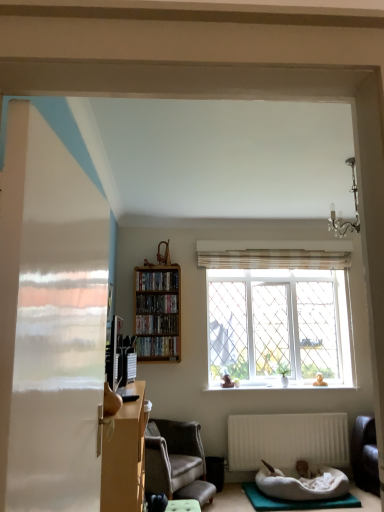
Describe the element at coordinates (156, 324) in the screenshot. I see `black glossy bookshelf at center, marked as the 2th book in a bottom-to-top arrangement` at that location.

What is the approximate height of white glass window at center?

white glass window at center is 4.41 feet in height.

This screenshot has height=512, width=384. What do you see at coordinates (278, 312) in the screenshot?
I see `white glass window at center` at bounding box center [278, 312].

You are a GUI agent. You are given a task and a screenshot of the screen. Output one action in this format:
    pyautogui.click(x=<x>, y=<y>)
    Task: Click on the dark gray fabric chair at lower left
    
    Given the screenshot: What is the action you would take?
    pyautogui.click(x=176, y=461)

The image size is (384, 512). What do you see at coordinates (287, 440) in the screenshot? I see `white matte radiator at lower center` at bounding box center [287, 440].

Describe the element at coordinates (157, 346) in the screenshot. I see `matte black bookshelf at center, which is the first book from bottom to top` at that location.

The height and width of the screenshot is (512, 384). What do you see at coordinates (294, 501) in the screenshot? I see `teal fabric yoga mat at lower right` at bounding box center [294, 501].

Find the location of `black glossy bookshelf at center, the 3th book when ordered from top to bottom`. black glossy bookshelf at center, the 3th book when ordered from top to bottom is located at coordinates (156, 324).

Who is more distant, shiny plastic dvds at center, the third book in the bottom-to-top sequence, or matte black bookshelf at center, which is the first book from bottom to top?

shiny plastic dvds at center, the third book in the bottom-to-top sequence, is more distant.

Is matte black bookshelf at center, which is counted as the fourth book, starting from the top, surrounded by shiny plastic dvds at center, acting as the second book starting from the top?

No, matte black bookshelf at center, which is counted as the fourth book, starting from the top, is not a part of shiny plastic dvds at center, acting as the second book starting from the top.

From the image's perspective, is shiny plastic dvds at center, the third book in the bottom-to-top sequence, above or below matte black bookshelf at center, which is counted as the fourth book, starting from the top?

shiny plastic dvds at center, the third book in the bottom-to-top sequence, is situated higher than matte black bookshelf at center, which is counted as the fourth book, starting from the top, in the image.

Which of these two, shiny plastic dvds at center, the third book in the bottom-to-top sequence, or matte black bookshelf at center, which is counted as the fourth book, starting from the top, is bigger?

matte black bookshelf at center, which is counted as the fourth book, starting from the top.

Can you confirm if matte black bookshelf at center, which is the first book from bottom to top, is bigger than black glossy bookshelf at center, the 3th book when ordered from top to bottom?

Correct, matte black bookshelf at center, which is the first book from bottom to top, is larger in size than black glossy bookshelf at center, the 3th book when ordered from top to bottom.

Is matte black bookshelf at center, which is the first book from bottom to top, placed right next to black glossy bookshelf at center, marked as the 2th book in a bottom-to-top arrangement?

No, matte black bookshelf at center, which is the first book from bottom to top, is not beside black glossy bookshelf at center, marked as the 2th book in a bottom-to-top arrangement.

Is matte black bookshelf at center, which is counted as the fourth book, starting from the top, facing away from black glossy bookshelf at center, the 3th book when ordered from top to bottom?

matte black bookshelf at center, which is counted as the fourth book, starting from the top, is not turned away from black glossy bookshelf at center, the 3th book when ordered from top to bottom.

Considering the relative positions of matte black bookshelf at center, which is the first book from bottom to top, and black glossy bookshelf at center, marked as the 2th book in a bottom-to-top arrangement, in the image provided, is matte black bookshelf at center, which is the first book from bottom to top, to the left or to the right of black glossy bookshelf at center, marked as the 2th book in a bottom-to-top arrangement,?

matte black bookshelf at center, which is the first book from bottom to top, is positioned on black glossy bookshelf at center, marked as the 2th book in a bottom-to-top arrangement,'s right side.

Can we say shiny plastic dvds at center, acting as the second book starting from the top, lies outside white matte radiator at lower center?

Yes, shiny plastic dvds at center, acting as the second book starting from the top, is outside of white matte radiator at lower center.

Is shiny plastic dvds at center, acting as the second book starting from the top, taller than white matte radiator at lower center?

Incorrect, the height of shiny plastic dvds at center, acting as the second book starting from the top, is not larger of that of white matte radiator at lower center.

From a real-world perspective, who is located lower, shiny plastic dvds at center, the third book in the bottom-to-top sequence, or white matte radiator at lower center?

white matte radiator at lower center is physically lower.

Could you tell me if shiny plastic dvds at center, acting as the second book starting from the top, is turned towards white matte radiator at lower center?

No, shiny plastic dvds at center, acting as the second book starting from the top, is not turned towards white matte radiator at lower center.

Does point (170, 284) appear closer or farther from the camera than point (263, 496)?

Point (170, 284).

Is wooden shelf at upper center, acting as the fourth book starting from the bottom, inside the boundaries of teal fabric yoga mat at lower right, or outside?

wooden shelf at upper center, acting as the fourth book starting from the bottom, lies outside teal fabric yoga mat at lower right.

Based on the photo, is teal fabric yoga mat at lower right at the back of wooden shelf at upper center, the 1th book in the top-to-bottom sequence?

wooden shelf at upper center, the 1th book in the top-to-bottom sequence, does not have its back to teal fabric yoga mat at lower right.

From a real-world perspective, between wooden shelf at upper center, acting as the fourth book starting from the bottom, and teal fabric yoga mat at lower right, who is vertically lower?

In real-world perspective, teal fabric yoga mat at lower right is lower.

Looking at this image, what's the angular difference between matte black bookshelf at center, which is counted as the fourth book, starting from the top, and white fluffy pet bed at lower center's facing directions?

They differ by 3.2 degrees in their facing directions.

Looking at this image, would you say matte black bookshelf at center, which is the first book from bottom to top, contains white fluffy pet bed at lower center?

No, white fluffy pet bed at lower center is not surrounded by matte black bookshelf at center, which is the first book from bottom to top.

Which is closer, (x=155, y=340) or (x=298, y=487)?

Point (x=155, y=340).

Which is more to the left, matte black bookshelf at center, which is the first book from bottom to top, or white fluffy pet bed at lower center?

From the viewer's perspective, matte black bookshelf at center, which is the first book from bottom to top, appears more on the left side.

Is shiny plastic dvds at center, acting as the second book starting from the top, looking in the opposite direction of black glossy bookshelf at center, the 3th book when ordered from top to bottom?

No, shiny plastic dvds at center, acting as the second book starting from the top, is not facing away from black glossy bookshelf at center, the 3th book when ordered from top to bottom.

Is shiny plastic dvds at center, acting as the second book starting from the top, inside or outside of black glossy bookshelf at center, the 3th book when ordered from top to bottom?

The correct answer is: outside.

Considering the positions of points (160, 304) and (150, 331), is point (160, 304) farther from camera compared to point (150, 331)?

Yes, point (160, 304) is farther from viewer.

Can you confirm if shiny plastic dvds at center, acting as the second book starting from the top, is positioned to the left of black glossy bookshelf at center, the 3th book when ordered from top to bottom?

Correct, you'll find shiny plastic dvds at center, acting as the second book starting from the top, to the left of black glossy bookshelf at center, the 3th book when ordered from top to bottom.

Could you measure the distance between wooden shelf at upper center, acting as the fourth book starting from the bottom, and white fluffy pet bed at lower center?

They are 7.20 feet apart.

How many degrees apart are the facing directions of wooden shelf at upper center, the 1th book in the top-to-bottom sequence, and white fluffy pet bed at lower center?

wooden shelf at upper center, the 1th book in the top-to-bottom sequence, and white fluffy pet bed at lower center are facing 3.2 degrees away from each other.

Is wooden shelf at upper center, the 1th book in the top-to-bottom sequence, looking in the opposite direction of white fluffy pet bed at lower center?

That's not correct — wooden shelf at upper center, the 1th book in the top-to-bottom sequence, is not looking away from white fluffy pet bed at lower center.

Is wooden shelf at upper center, acting as the fourth book starting from the bottom, positioned beyond the bounds of white fluffy pet bed at lower center?

wooden shelf at upper center, acting as the fourth book starting from the bottom, lies outside white fluffy pet bed at lower center's area.

From a real-world perspective, which book is the 2nd one above the matte black bookshelf at center, which is the first book from bottom to top? Please provide its 2D coordinates.

[(157, 303)]

Locate an element on the screen. Image resolution: width=384 pixels, height=512 pixels. book below the black glossy bookshelf at center, marked as the 2th book in a bottom-to-top arrangement (from a real-world perspective) is located at coordinates (157, 346).

Which object lies nearer to the anchor point wooden shelf at upper center, the 1th book in the top-to-bottom sequence, black glossy bookshelf at center, the 3th book when ordered from top to bottom, or dark gray fabric chair at lower left?

black glossy bookshelf at center, the 3th book when ordered from top to bottom, is positioned closer to the anchor wooden shelf at upper center, the 1th book in the top-to-bottom sequence.

Based on their spatial positions, is dark gray fabric chair at lower left or white fluffy pet bed at lower center further from black glossy bookshelf at center, marked as the 2th book in a bottom-to-top arrangement?

white fluffy pet bed at lower center.

Estimate the real-world distances between objects in this image. Which object is further from black glossy bookshelf at center, marked as the 2th book in a bottom-to-top arrangement, wooden bookshelf at center or teal fabric yoga mat at lower right?

teal fabric yoga mat at lower right lies further to black glossy bookshelf at center, marked as the 2th book in a bottom-to-top arrangement, than the other object.

Which object lies nearer to the anchor point matte black bookshelf at center, which is the first book from bottom to top, dark gray fabric chair at lower left or white fluffy pet bed at lower center?

Based on the image, dark gray fabric chair at lower left appears to be nearer to matte black bookshelf at center, which is the first book from bottom to top.

Estimate the real-world distances between objects in this image. Which object is closer to white fluffy pet bed at lower center, matte black bookshelf at center, which is counted as the fourth book, starting from the top, or dark gray fabric chair at lower left?

dark gray fabric chair at lower left is closer to white fluffy pet bed at lower center.

Considering their positions, is teal fabric yoga mat at lower right positioned closer to shiny plastic dvds at center, acting as the second book starting from the top, than black glossy bookshelf at center, marked as the 2th book in a bottom-to-top arrangement?

black glossy bookshelf at center, marked as the 2th book in a bottom-to-top arrangement, is positioned closer to the anchor shiny plastic dvds at center, acting as the second book starting from the top.

Looking at the image, which one is located further to white glass window at center, wooden bookshelf at center or matte brown desk at left?

matte brown desk at left is further to white glass window at center.

When comparing their distances from white glass window at center, does white matte radiator at lower center or dark gray fabric chair at lower left seem further?

The object further to white glass window at center is dark gray fabric chair at lower left.

Locate an element on the screen. This screenshot has width=384, height=512. radiator between matte brown desk at left and shiny plastic dvds at center, the third book in the bottom-to-top sequence, from front to back is located at coordinates (287, 440).

In order to click on chair positioned between matte brown desk at left and wooden bookshelf at center from near to far in this screenshot , I will do `click(176, 461)`.

Image resolution: width=384 pixels, height=512 pixels. I want to click on radiator situated between dark gray fabric chair at lower left and white fluffy pet bed at lower center from left to right, so click(x=287, y=440).

The image size is (384, 512). I want to click on window between wooden shelf at upper center, acting as the fourth book starting from the bottom, and dark gray fabric chair at lower left in the up-down direction, so click(x=278, y=312).